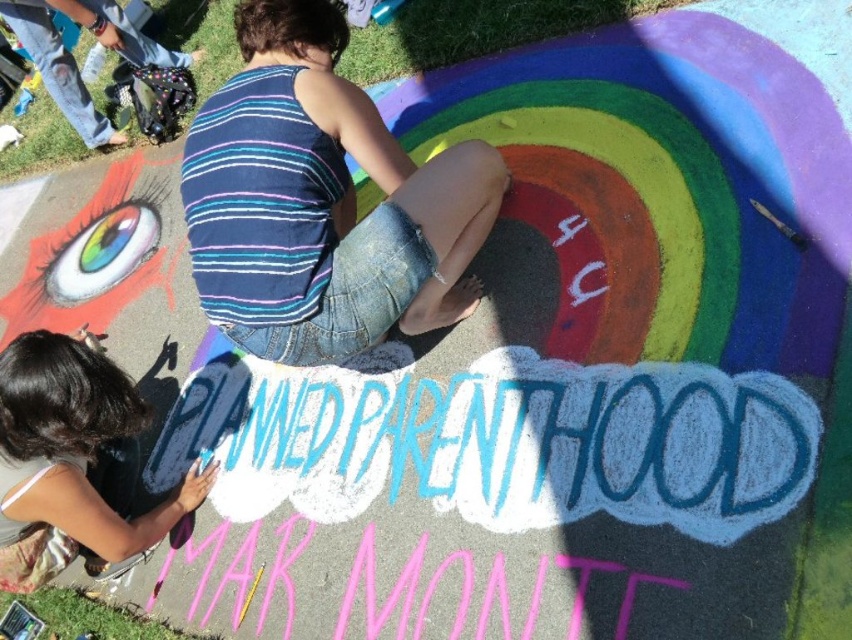
You are standing at the center of the image. There is a point at coordinates [321,202]. What object is located at that point?

The blue striped tank top at center is located at point [321,202].

You are a photographer taking a picture of the chalk mural. You notice the blue striped tank top at center and the smooth black hair at upper left. Which object is positioned farther to the left in the image?

The smooth black hair at upper left is positioned farther to the left in the image than the blue striped tank top at center.

You are standing at the center of the paved surface where the chalk mural is created. You see two points marked on the ground. The first point is at coordinates point (239, 99) and the second point is at point (56, 444). If you were to walk towards the first point, would you be moving closer to the large stylized eye or the rainbow arch?

The point (239, 99) is in front of point (56, 444). Since the large stylized eye is on the left side of the frame, moving towards the first point would mean you are getting closer to the large stylized eye.